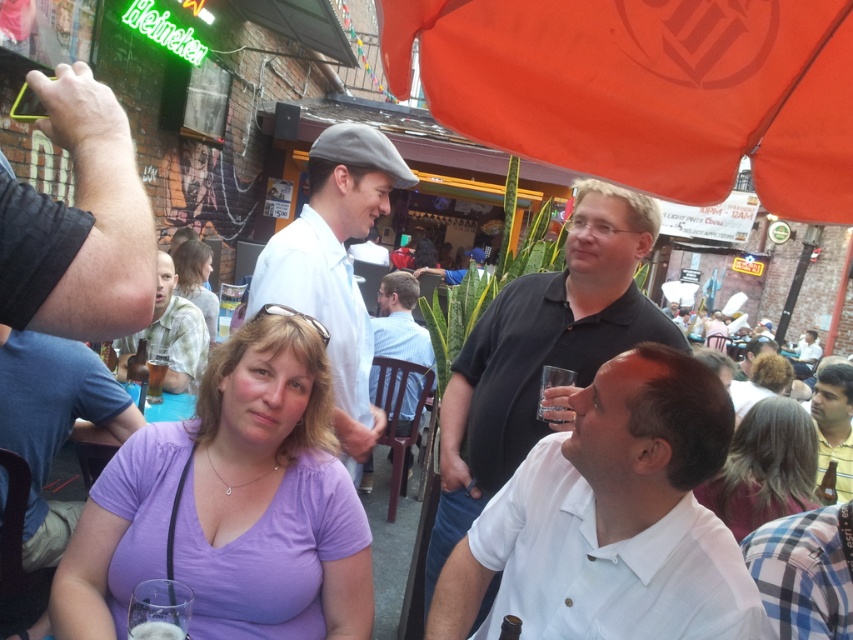
Who is lower down, dark brown leather arm at upper left or clear glass at lower left?

clear glass at lower left is below.

Measure the distance between dark brown leather arm at upper left and camera.

They are 82.01 centimeters apart.

In order to click on dark brown leather arm at upper left in this screenshot , I will do `click(79, 224)`.

Locate an element on the screen. The height and width of the screenshot is (640, 853). dark brown leather arm at upper left is located at coordinates (79, 224).

Is point (743, 465) less distant than point (184, 246)?

Yes.

I want to click on blonde hair at lower right, so click(x=764, y=467).

Can you confirm if blonde hair at lower right is bigger than light blue shirt at center?

No, blonde hair at lower right is not bigger than light blue shirt at center.

Between point (776, 468) and point (375, 326), which one is positioned behind?

Point (375, 326)

Find the location of `blonde hair at lower right`. blonde hair at lower right is located at coordinates (764, 467).